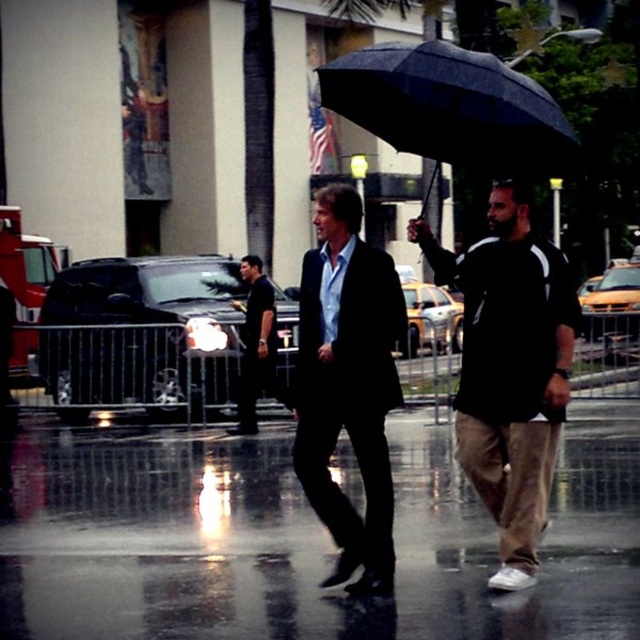
Question: Estimate the real-world distances between objects in this image. Which object is closer to the black matte umbrella at center?

Choices:
 (A) black matte shirt at center
 (B) black matte umbrella at right
 (C) glossy asphalt pavement at center
 (D) matte black suit at center

Answer: (B)

Question: Observing the image, what is the correct spatial positioning of black matte umbrella at right in reference to black matte shirt at center?

Choices:
 (A) left
 (B) right

Answer: (B)

Question: Which point is closer to the camera?

Choices:
 (A) (522, 93)
 (B) (388, 586)

Answer: (A)

Question: Considering the relative positions of glossy asphalt pavement at center and black matte shirt at center in the image provided, where is glossy asphalt pavement at center located with respect to black matte shirt at center?

Choices:
 (A) below
 (B) above

Answer: (A)

Question: Is glossy asphalt pavement at center positioned behind matte black suit at center?

Choices:
 (A) yes
 (B) no

Answer: (B)

Question: Which object appears closest to the camera in this image?

Choices:
 (A) black matte shirt at center
 (B) glossy asphalt pavement at center
 (C) black matte umbrella at right

Answer: (B)